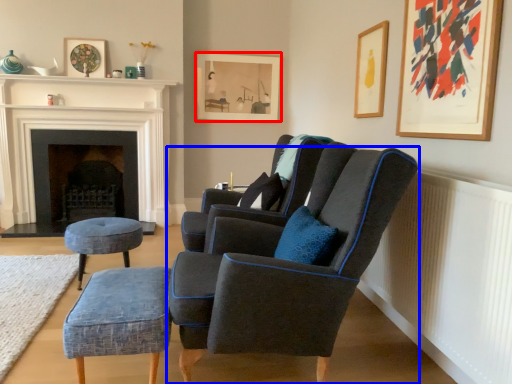
Question: Among these objects, which one is nearest to the camera, picture frame (highlighted by a red box) or chair (highlighted by a blue box)?

Choices:
 (A) picture frame
 (B) chair

Answer: (B)